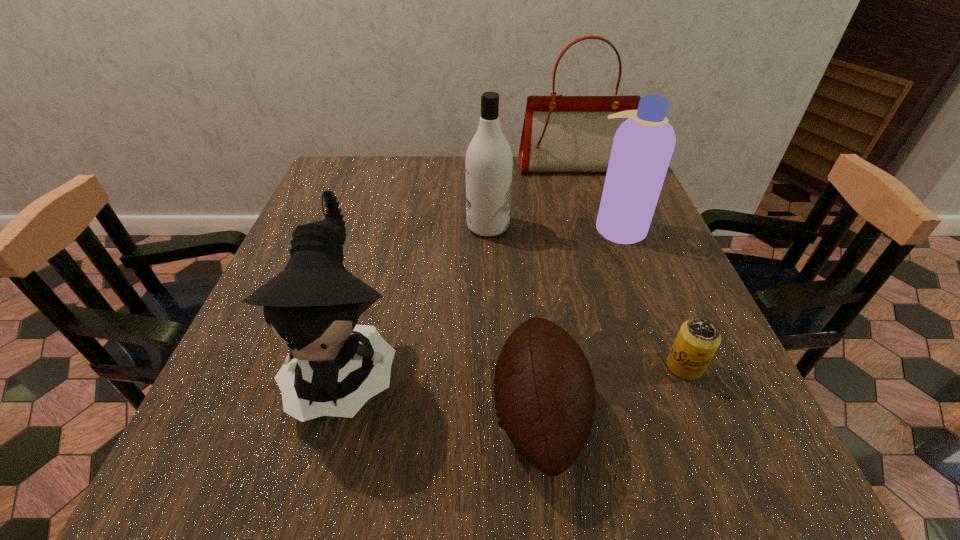
This screenshot has width=960, height=540. I want to click on blank area located 0.240m on the front of the right shampoo, so (656, 326).

The height and width of the screenshot is (540, 960). What are the coordinates of `free space located at the face of the leftmost object` in the screenshot? It's located at (317, 476).

You are a GUI agent. You are given a task and a screenshot of the screen. Output one action in this format:
    pyautogui.click(x=<x>, y=<y>)
    Task: Click on the free space located 0.300m on the laces of the football
    
    Given the screenshot: What is the action you would take?
    pyautogui.click(x=306, y=414)

Where is `vacant point located 0.260m on the laces of the football`? vacant point located 0.260m on the laces of the football is located at coordinates (331, 414).

Identify the location of vacant space located 0.400m on the laces of the football. (244, 414).

What are the coordinates of `vacant region located on the back of the beer can` in the screenshot? It's located at (630, 232).

You are a GUI agent. You are given a task and a screenshot of the screen. Output one action in this format:
    pyautogui.click(x=<x>, y=<y>)
    Task: Click on the object present at the far edge
    This screenshot has height=540, width=960.
    Given the screenshot: What is the action you would take?
    pyautogui.click(x=561, y=134)

Locate an element on the screen. The width and height of the screenshot is (960, 540). object located at the near edge is located at coordinates (545, 398).

Locate an element on the screen. object present at the left edge is located at coordinates (313, 305).

Where is `handbag positioned at the right edge`? handbag positioned at the right edge is located at coordinates (561, 134).